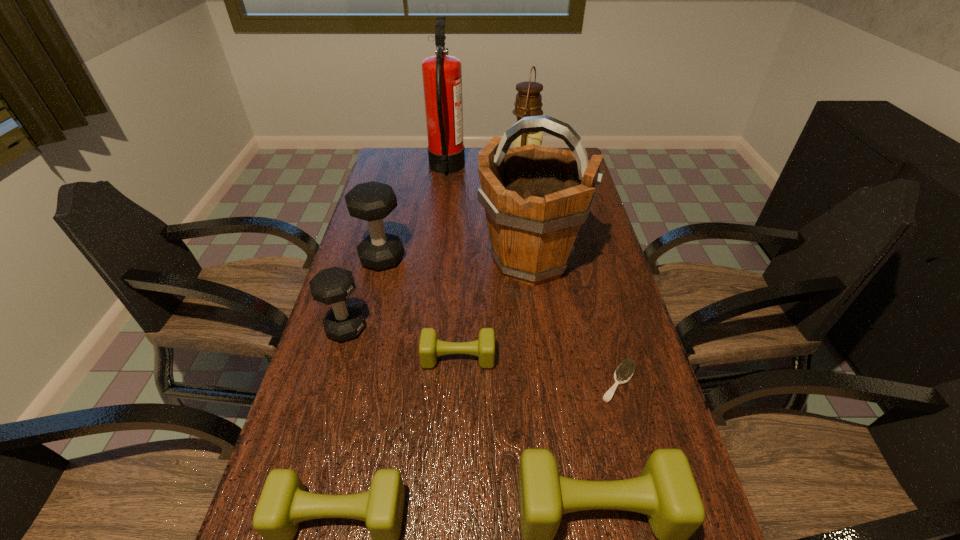
Locate an element on the screen. free point located 0.350m on the front-facing side of the red fire extinguisher is located at coordinates (551, 169).

This screenshot has height=540, width=960. I want to click on free space located on the left of the bucket, so click(x=378, y=261).

Where is `blank space located on the front of the oil lamp`? The width and height of the screenshot is (960, 540). blank space located on the front of the oil lamp is located at coordinates pos(531,220).

Image resolution: width=960 pixels, height=540 pixels. I want to click on vacant space positioned 0.100m on the back of the farther gray dumbbell, so click(x=391, y=225).

This screenshot has height=540, width=960. Find the location of `free space located 0.400m on the right of the smaller gray dumbbell`. free space located 0.400m on the right of the smaller gray dumbbell is located at coordinates (516, 328).

I want to click on vacant space located 0.360m on the right of the second dumbbell from right to left, so click(638, 358).

What are the coordinates of `vacant space located 0.260m on the front of the shortest object` in the screenshot? It's located at (658, 529).

The width and height of the screenshot is (960, 540). What are the coordinates of `fire extinguisher located at the far edge` in the screenshot? It's located at (442, 74).

This screenshot has width=960, height=540. In order to click on oil lamp that is positioned at the far edge in this screenshot , I will do `click(528, 103)`.

Identify the location of bucket positioned at the right edge. (535, 198).